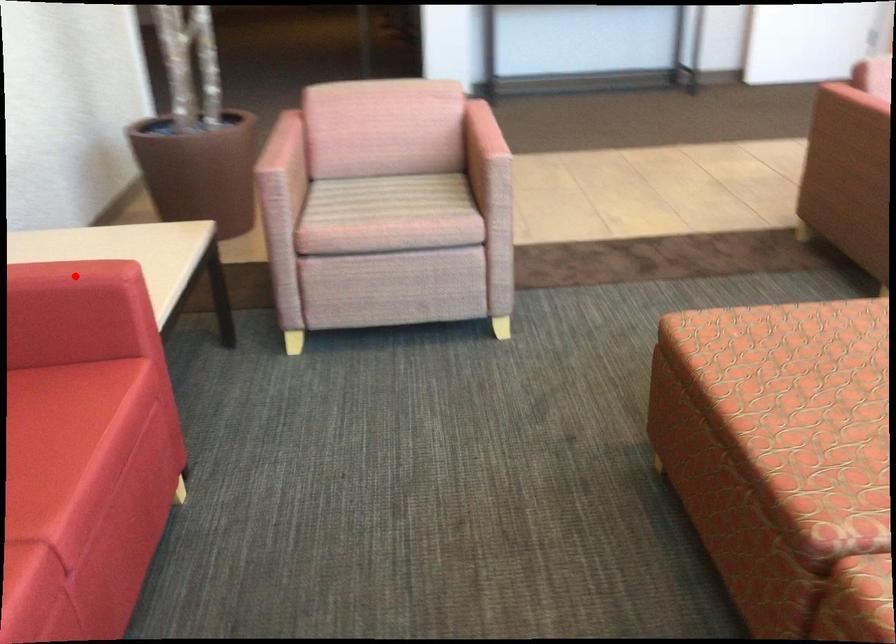
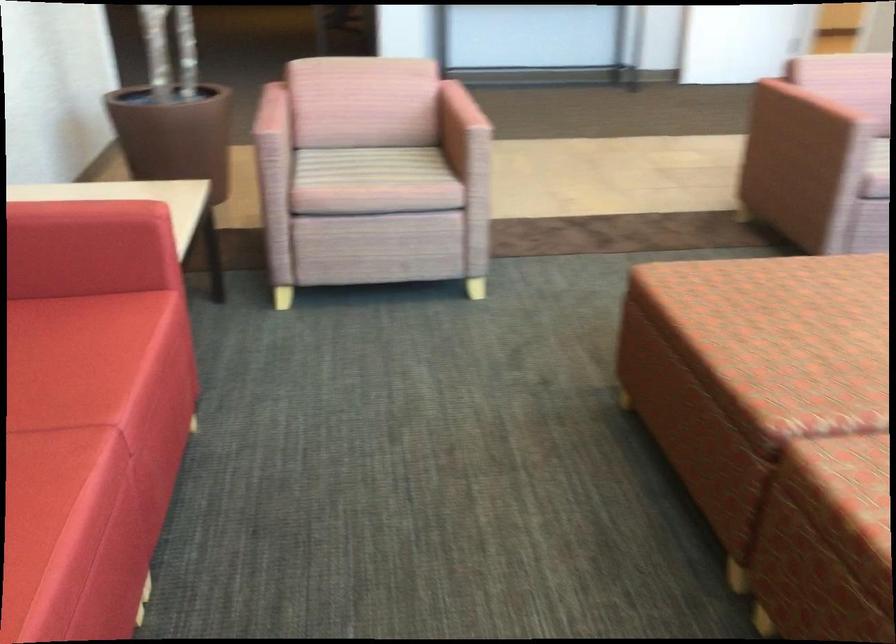
Question: I am providing you with two images of the same scene from different viewpoints. A red point is marked on the first image. At the location where the point appears in image 1, is it still visible in image 2?

Choices:
 (A) Yes
 (B) No

Answer: (A)